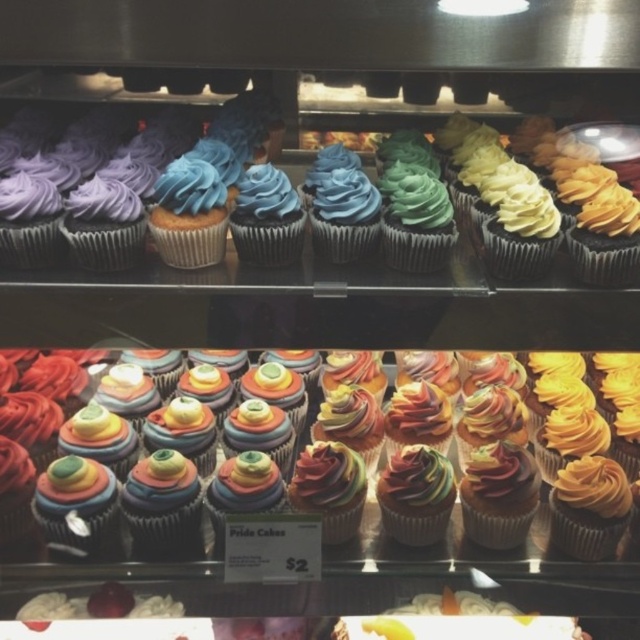
Question: Can you confirm if matte chocolate cupcake at center is thinner than rainbow frosting cupcake at center?

Choices:
 (A) yes
 (B) no

Answer: (A)

Question: Is matte chocolate cupcake at center positioned before rainbow frosting cupcake at center?

Choices:
 (A) no
 (B) yes

Answer: (B)

Question: Which point is farther to the camera?

Choices:
 (A) rainbow frosting cupcake at center
 (B) matte chocolate cupcake at center

Answer: (A)

Question: Does matte chocolate cupcake at center appear on the left side of rainbow frosting cupcake at center?

Choices:
 (A) yes
 (B) no

Answer: (A)

Question: Which point is closer to the camera taking this photo?

Choices:
 (A) (243, 509)
 (B) (333, 173)

Answer: (B)